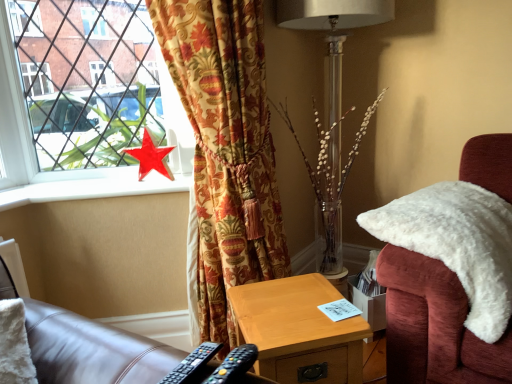
You are a GUI agent. You are given a task and a screenshot of the screen. Output one action in this format:
    pyautogui.click(x=<x>, y=<y>)
    Task: Click on the free space in front of red glossy star at window
    
    Given the screenshot: What is the action you would take?
    pyautogui.click(x=142, y=182)